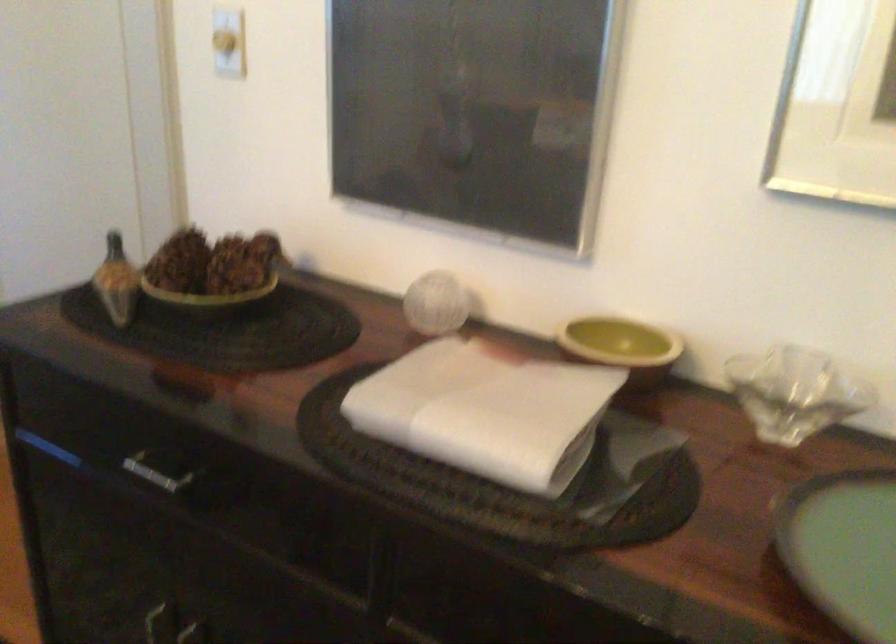
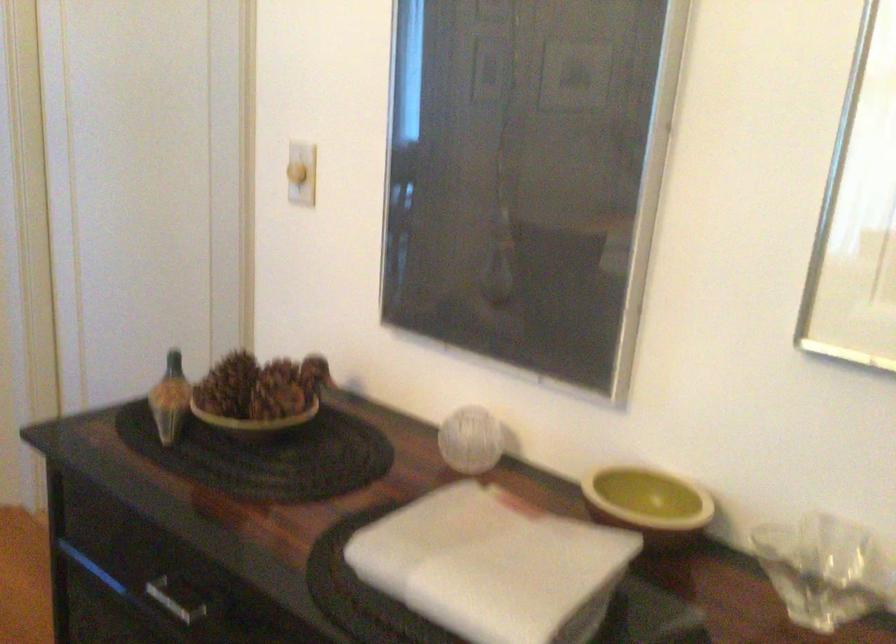
Where in the second image is the point corresponding to (216,269) from the first image?

(259, 395)